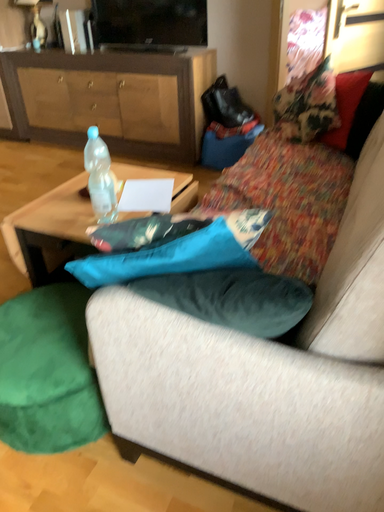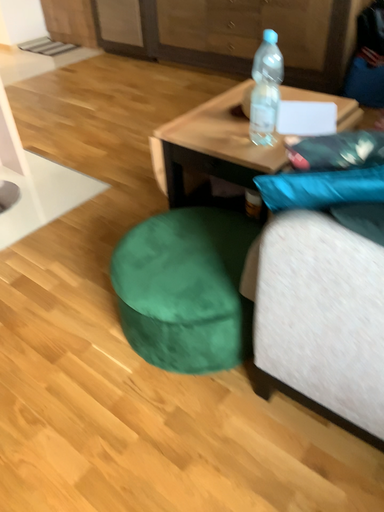
Question: Which way did the camera rotate in the video?

Choices:
 (A) rotated downward
 (B) rotated upward

Answer: (A)